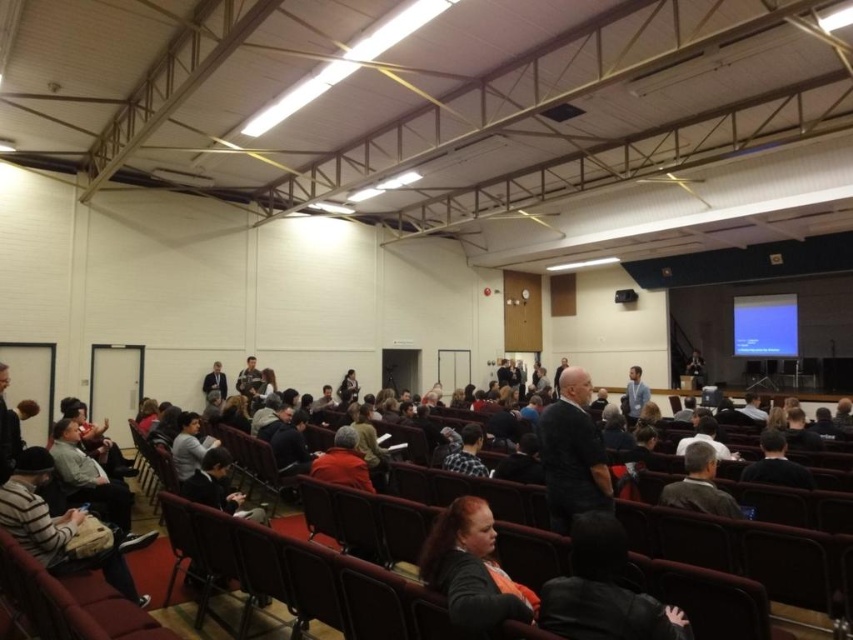
You are organizing a seating arrangement for a workshop and need to ensure that the gray wool sweater at center and the dark gray sweater at center can both fit on a shelf that has limited space. Based on the image, which sweater would require more space on the shelf?

The dark gray sweater at center requires more space because it occupies more space than the gray wool sweater at center according to the description.